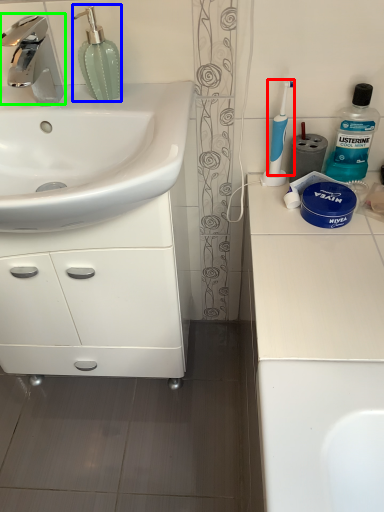
Question: Considering the real-world distances, which object is closest to toothbrush (highlighted by a red box)? soap dispenser (highlighted by a blue box) or tap (highlighted by a green box).

Choices:
 (A) soap dispenser
 (B) tap

Answer: (A)